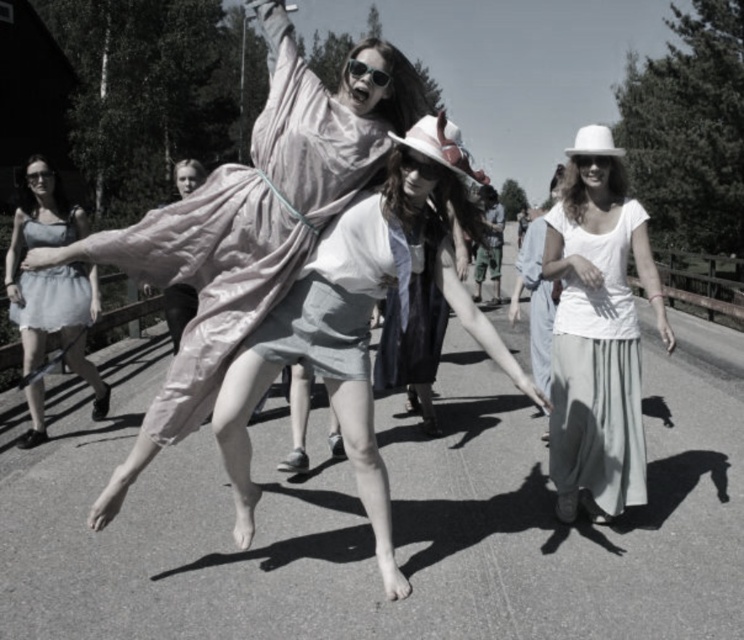
You are organizing a costume party and need to decide which accessory to place on a narrow shelf. The shelf can only hold items that are not wider than the other. Based on the image, which accessory should you choose between the white cotton hat at upper right and the matte black goggles at upper left?

The white cotton hat at upper right might be wider than matte black goggles at upper left, so to fit on the narrow shelf, you should choose the matte black goggles at upper left since it is likely narrower.

You are a photographer trying to capture the perfect shot of the matte white dress at center and the shiny plastic sunglasses at center. Since you want to ensure both are clearly visible in the photo, which object should you focus on first to account for their sizes?

The matte white dress at center has a larger size compared to the shiny plastic sunglasses at center, so you should focus on the matte white dress at center first to ensure it is in sharp focus before adjusting for the smaller sunglasses.